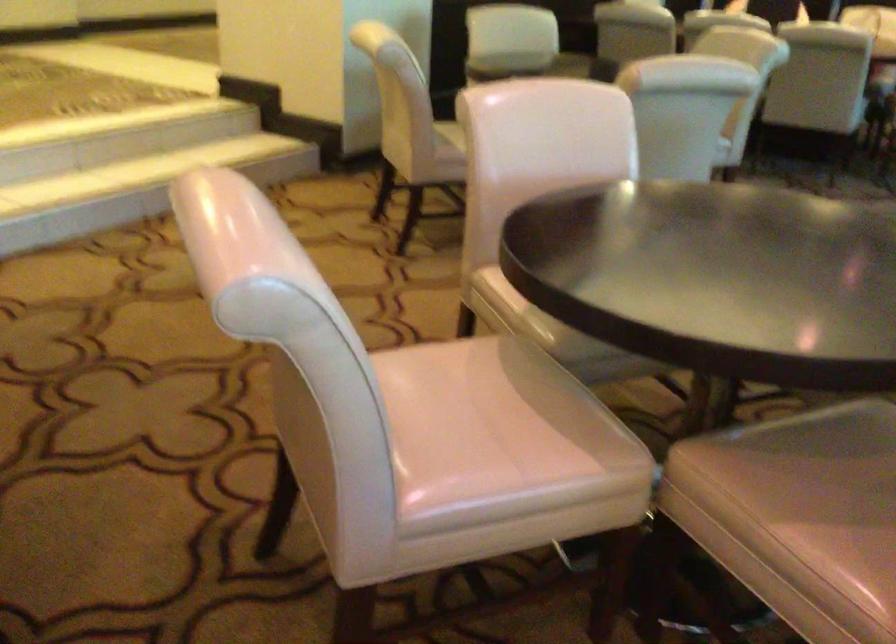
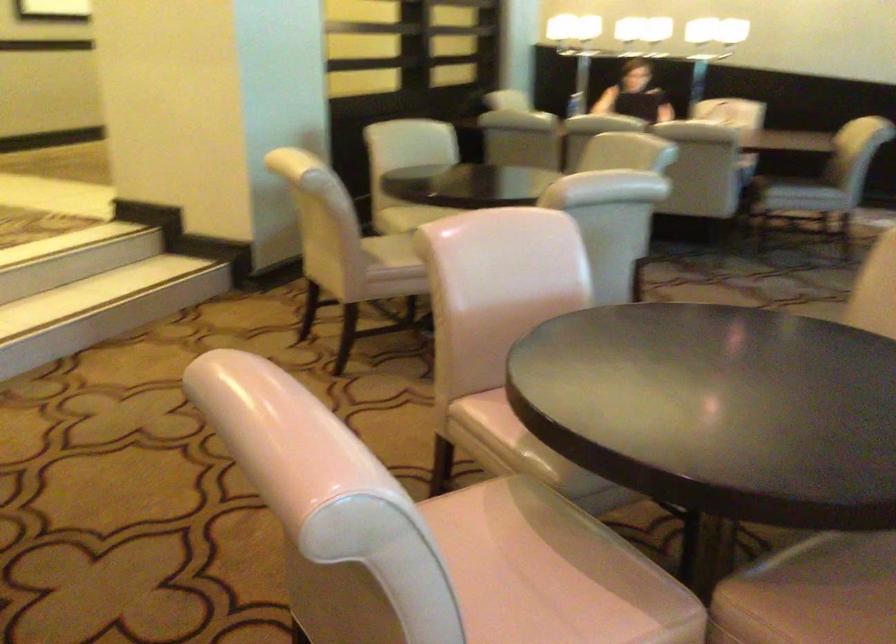
Question: The camera is either moving clockwise (left) or counter-clockwise (right) around the object. The first image is from the beginning of the video and the second image is from the end. Is the camera moving left or right when shooting the video?

Choices:
 (A) Left
 (B) Right

Answer: (A)